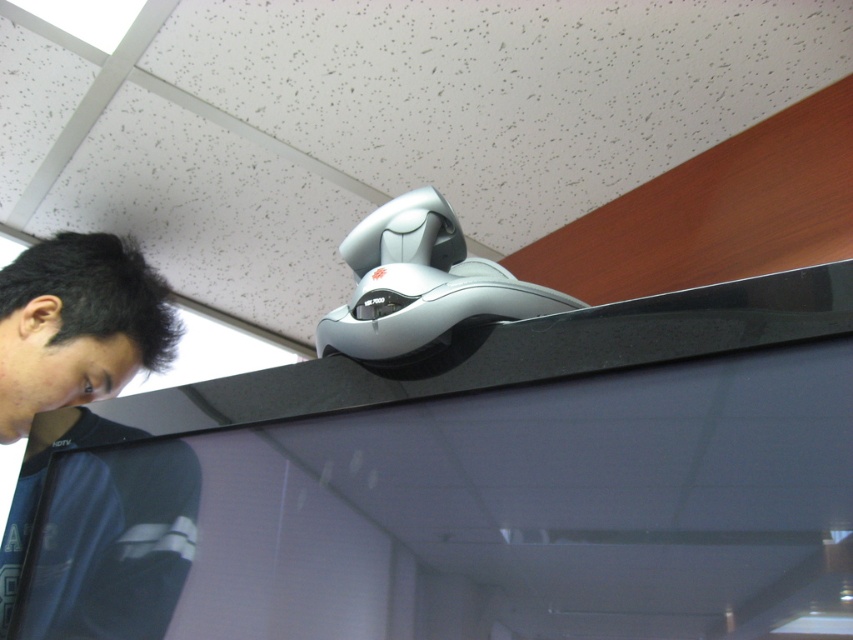
You are standing in the office and want to place a new keyboard between the glossy plastic monitor at upper center and the black fabric at lower left. According to their positions, which object should the keyboard be closer to?

The glossy plastic monitor at upper center is positioned on the right side of black fabric at lower left, so the keyboard should be placed closer to the glossy plastic monitor at upper center to be between them.

You are standing in the office and need to place a small object exactly at the coordinates given for the black fabric at lower left. What are the coordinates where you should place it?

The coordinates for the black fabric at lower left are at point (70, 358).